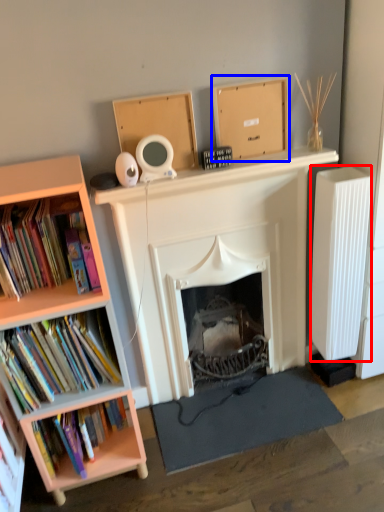
Question: Which object is closer to the camera taking this photo, radiator (highlighted by a red box) or cardboard box (highlighted by a blue box)?

Choices:
 (A) radiator
 (B) cardboard box

Answer: (B)